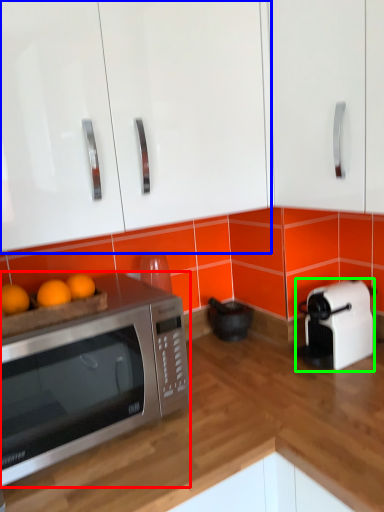
Question: Which object is the farthest from microwave oven (highlighted by a red box)? Choose among these: cabinetry (highlighted by a blue box) or toaster (highlighted by a green box).

Choices:
 (A) cabinetry
 (B) toaster

Answer: (B)